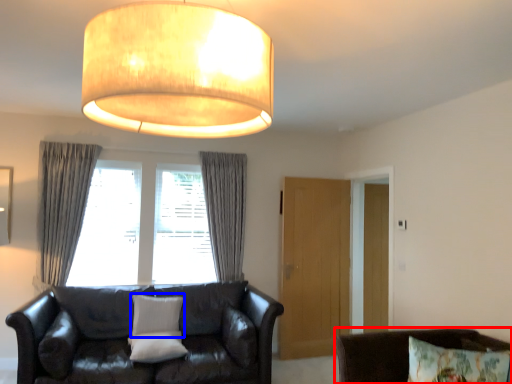
Question: Which object appears closest to the camera in this image, chair (highlighted by a red box) or pillow (highlighted by a blue box)?

Choices:
 (A) chair
 (B) pillow

Answer: (A)